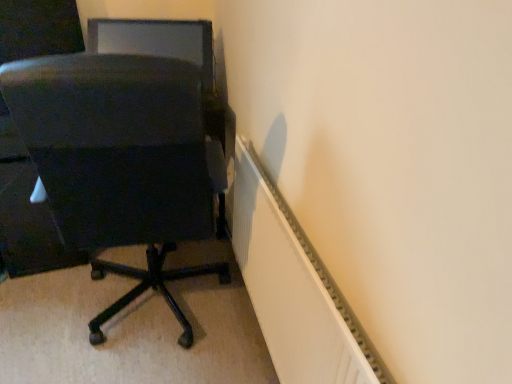
Where is `free spot above white ribbed radiator at lower right (from a real-world perspective)`? free spot above white ribbed radiator at lower right (from a real-world perspective) is located at coordinates (287, 230).